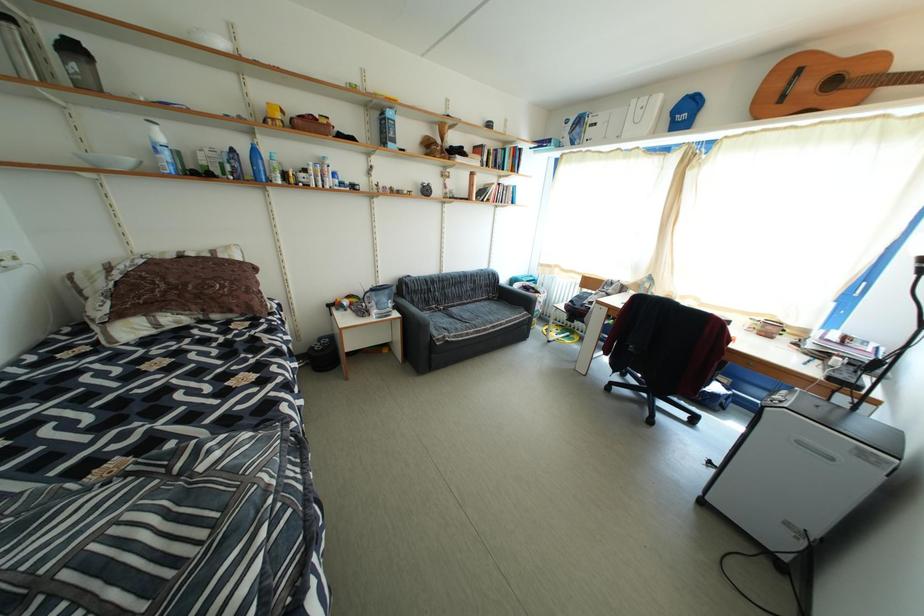
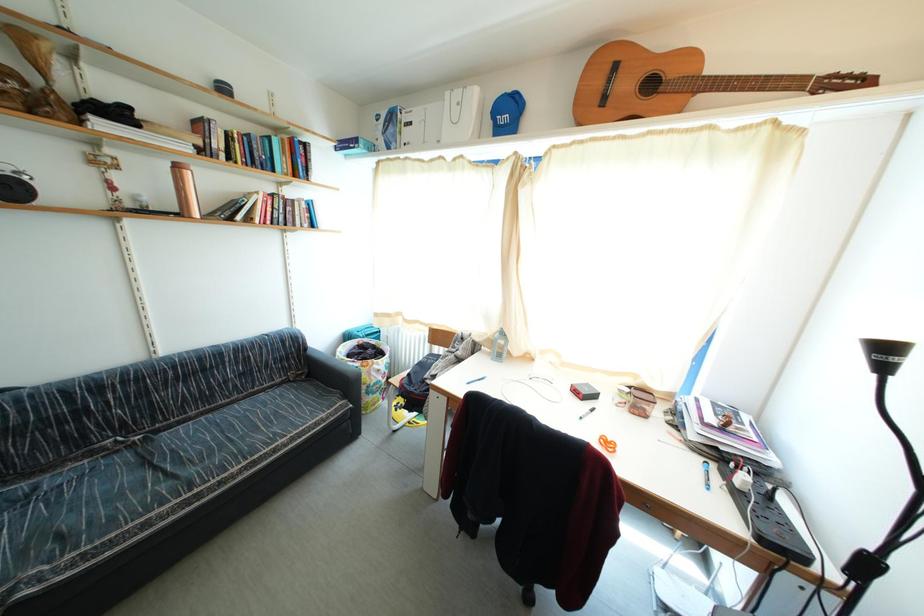
Which direction would the cameraman need to move to produce the second image?

The movement direction of the cameraman is right, forward.